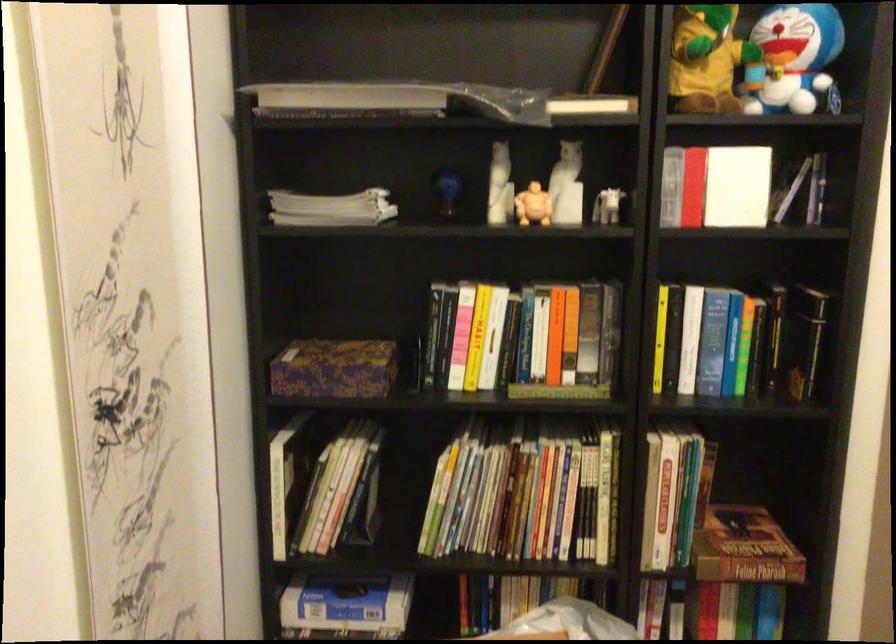
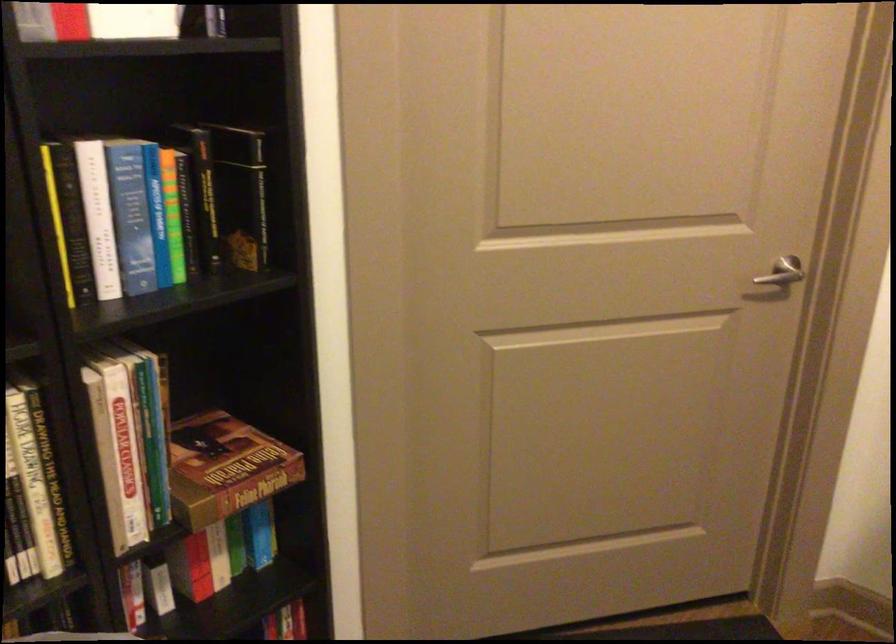
Question: The first image is from the beginning of the video and the second image is from the end. How did the camera likely rotate when shooting the video?

Choices:
 (A) Left
 (B) Right
 (C) Up
 (D) Down

Answer: (B)